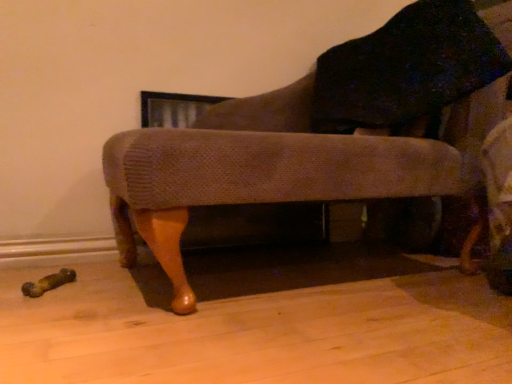
Identify the location of knitted fabric ottoman at center. (326, 131).

What do you see at coordinates (326, 131) in the screenshot? This screenshot has width=512, height=384. I see `knitted fabric ottoman at center` at bounding box center [326, 131].

At what (x,y) coordinates should I click in order to perform the action: click on knitted fabric ottoman at center. Please return your answer as a coordinate pair (x, y). The image size is (512, 384). Looking at the image, I should click on (326, 131).